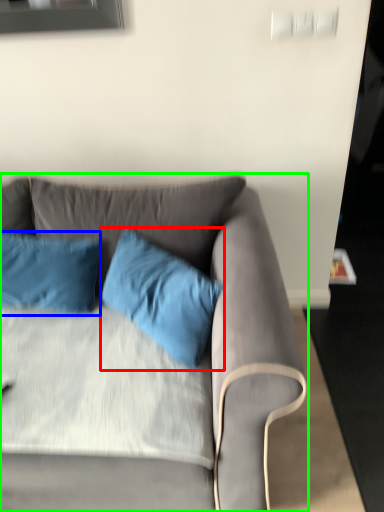
Question: Which object is positioned closest to pillow (highlighted by a red box)? Select from pillow (highlighted by a blue box) and studio couch (highlighted by a green box).

Choices:
 (A) pillow
 (B) studio couch

Answer: (B)